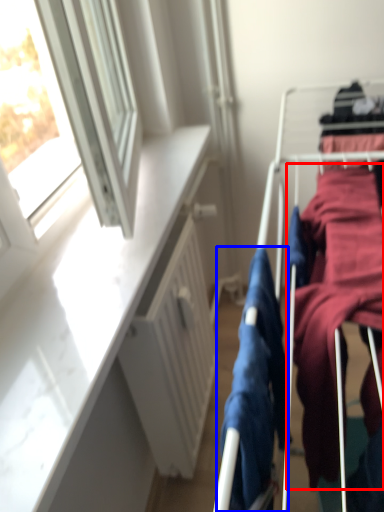
Question: Which object appears farthest to the camera in this image, clothing (highlighted by a red box) or clothing (highlighted by a blue box)?

Choices:
 (A) clothing
 (B) clothing

Answer: (A)